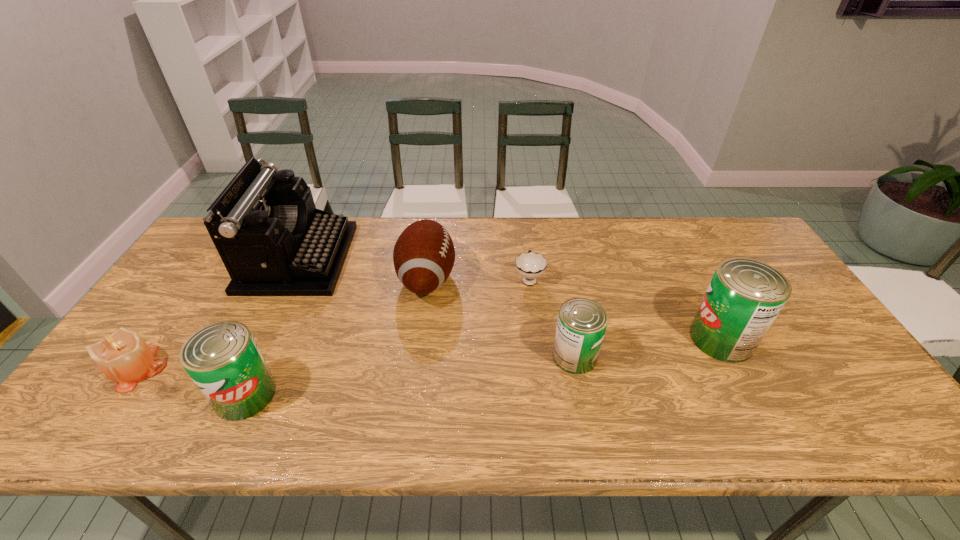
Find the location of `free space that satisfies the following two spatial constraints: 1. on the side of the cup with the handle; 2. on the laces of the football`. free space that satisfies the following two spatial constraints: 1. on the side of the cup with the handle; 2. on the laces of the football is located at coordinates (529, 278).

Locate an element on the screen. The width and height of the screenshot is (960, 540). free region that satisfies the following two spatial constraints: 1. on the laces of the rightmost object; 2. on the left side of the fourth object from left to right is located at coordinates (419, 339).

This screenshot has width=960, height=540. I want to click on free spot that satisfies the following two spatial constraints: 1. on the side of the cup with the handle; 2. on the typing side of the tallest object, so click(x=526, y=258).